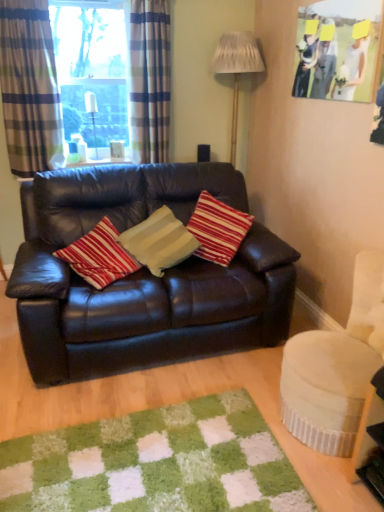
Image resolution: width=384 pixels, height=512 pixels. I want to click on free point above green shaggy mat at lower center (from a real-world perspective), so click(x=137, y=459).